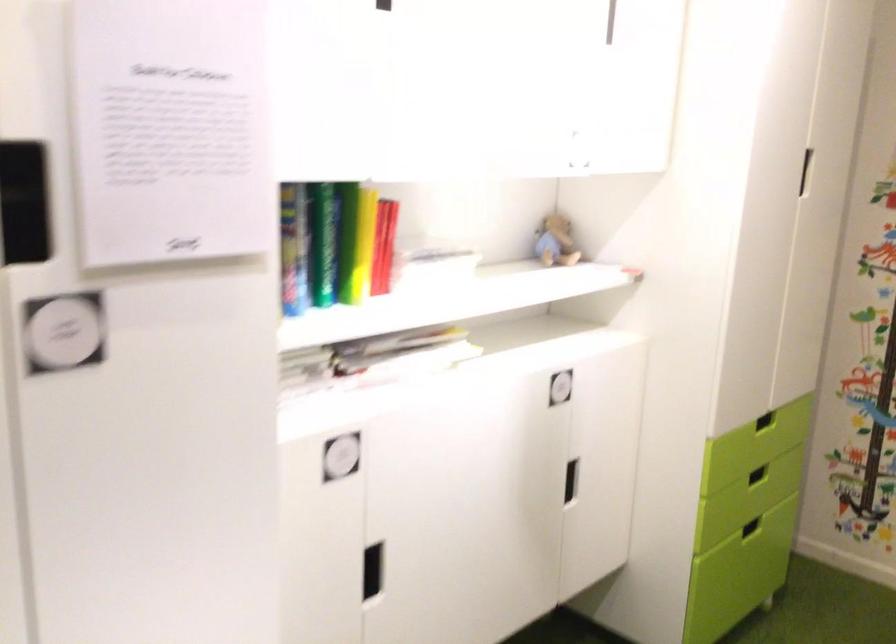
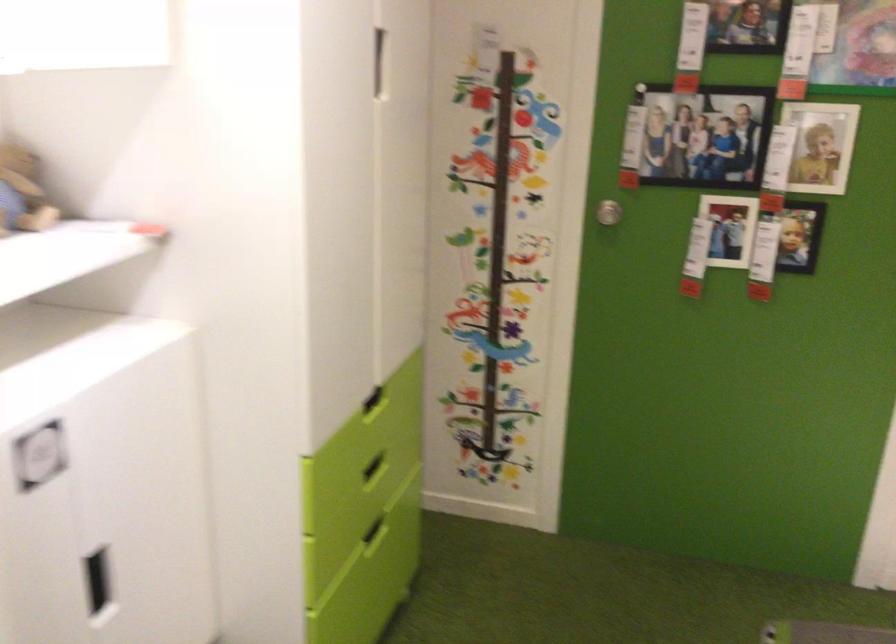
Question: The camera is either moving clockwise (left) or counter-clockwise (right) around the object. The first image is from the beginning of the video and the second image is from the end. Is the camera moving left or right when shooting the video?

Choices:
 (A) Left
 (B) Right

Answer: (A)